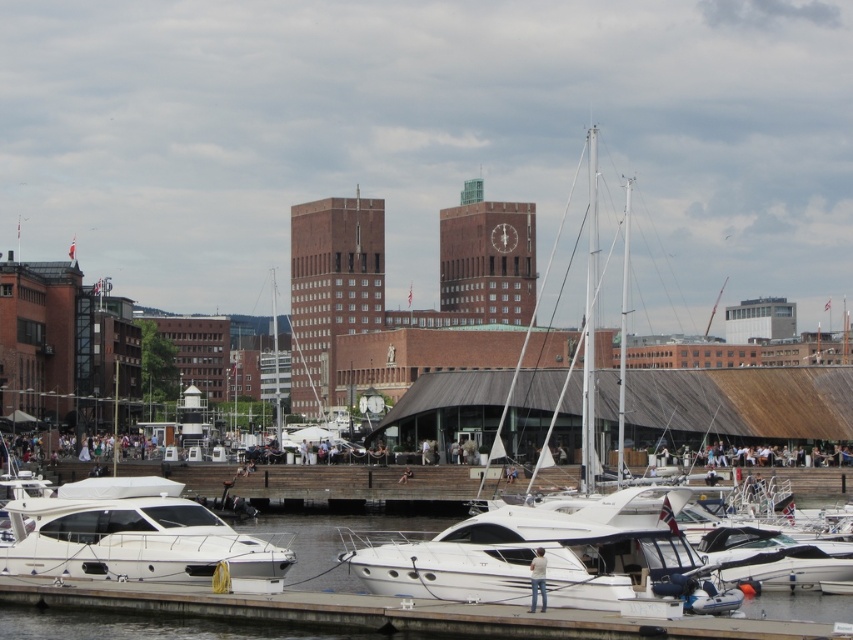
You are standing at the wooden walkway in the marina scene. You see a point marked at coordinates (134, 536). What object is located at that point?

The point at coordinates (134, 536) corresponds to the white glossy motorboat at lower left.